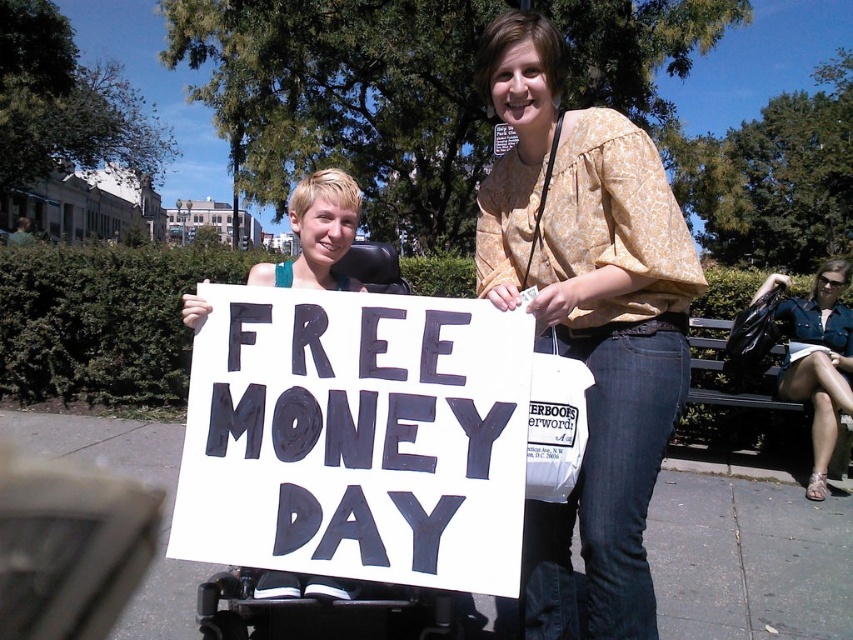
This screenshot has height=640, width=853. What do you see at coordinates (357, 436) in the screenshot?
I see `white paper sign at center` at bounding box center [357, 436].

Which is more to the left, white paper sign at center or printed cotton blouse at center?

white paper sign at center is more to the left.

Is point (271, 310) positioned after point (581, 472)?

No, it is not.

Where is `white paper sign at center`? The height and width of the screenshot is (640, 853). white paper sign at center is located at coordinates (357, 436).

Is printed cotton blouse at center smaller than dark brown wooden bench at right?

No, printed cotton blouse at center is not smaller than dark brown wooden bench at right.

Is point (659, 196) closer to camera compared to point (693, 346)?

Yes.

At what (x,y) coordinates should I click in order to perform the action: click on printed cotton blouse at center. Please return your answer as a coordinate pair (x, y). The height and width of the screenshot is (640, 853). Looking at the image, I should click on (587, 317).

Is point (231, 337) positioned in front of point (822, 481)?

Yes, point (231, 337) is closer to viewer.

Looking at this image, is white paper sign at center below denim shorts at lower right?

No.

Does point (439, 321) come closer to viewer compared to point (833, 266)?

Yes, it is.

Where is `white paper sign at center`? white paper sign at center is located at coordinates (357, 436).